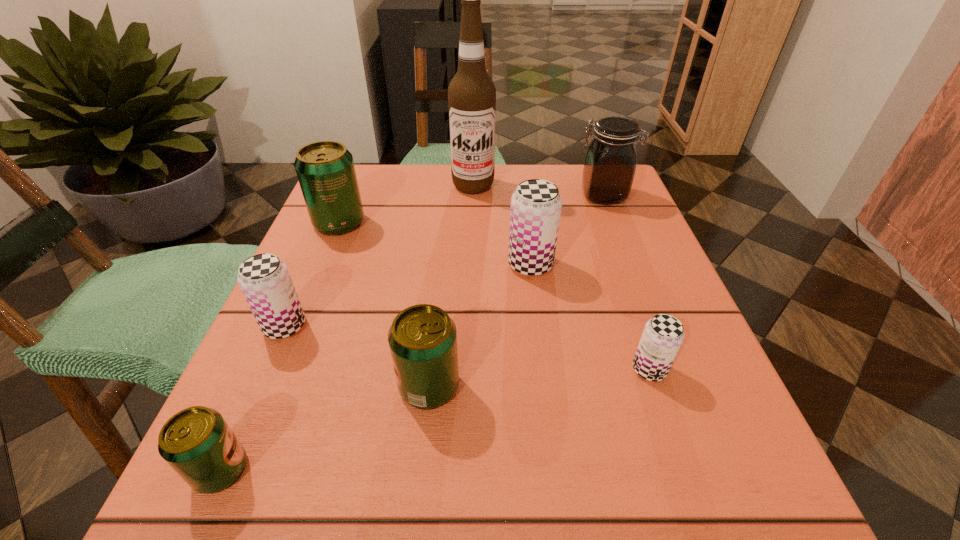
Identify the location of the nearest purple beer can. This screenshot has height=540, width=960. (663, 335).

Locate an element on the screen. The height and width of the screenshot is (540, 960). the rightmost purple beer can is located at coordinates (663, 335).

This screenshot has width=960, height=540. In order to click on the nearest beer can in this screenshot , I will do `click(197, 443)`.

Locate an element on the screen. The image size is (960, 540). the nearest green beer can is located at coordinates (197, 443).

In order to click on vacant point located on the label of the alcohol in this screenshot , I will do tap(470, 300).

Locate an element on the screen. free space located 0.170m on the lid of the jar is located at coordinates pos(503,196).

The image size is (960, 540). What are the coordinates of `free region located on the lid of the jar` in the screenshot? It's located at (418, 196).

Locate an element on the screen. free space located on the lid of the jar is located at coordinates (430, 196).

The image size is (960, 540). Identify the location of vacant space situated 0.230m on the right of the third farthest object. (471, 222).

The height and width of the screenshot is (540, 960). Identify the location of free location located on the back of the second purple beer can from right to left. (518, 172).